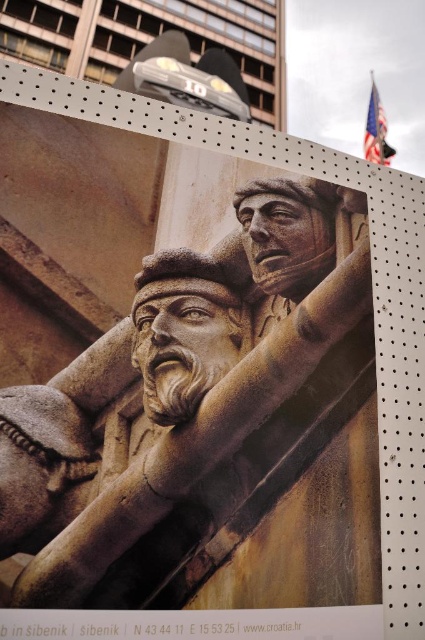
From the picture: You are an art student analyzing the spatial arrangement of the two stone sculptures in the image. Which sculpture, the rustic stone sculpture at center or the carved stone man at center, appears nearer to you?

The rustic stone sculpture at center appears nearer to the viewer because it is closer than the carved stone man at center.

You are an art student analyzing the positioning of the two stone figures in the image. Which of the two, the rustic stone sculpture at center or the carved stone man at center, is placed higher up in the composition?

The carved stone man at center is placed higher up in the composition because the rustic stone sculpture at center is below it according to the description.

You are standing in front of the large photograph of two stone statues mounted on a perforated metal surface. The statues are part of a historical monument. You want to know how far the point at coordinates point (163, 340) is from your current position. Can you determine the distance?

The distance of point (163, 340) from camera is 4.12 feet.